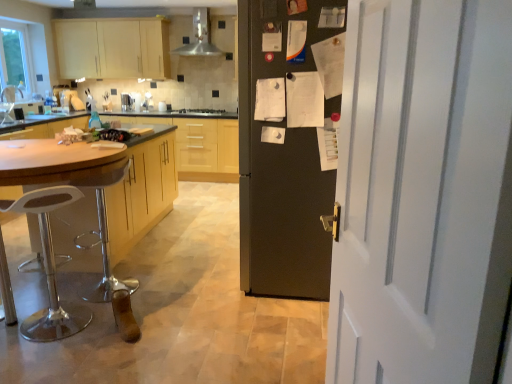
In order to click on vacant area that is in front of white plastic bar stool at left in this screenshot , I will do `click(41, 357)`.